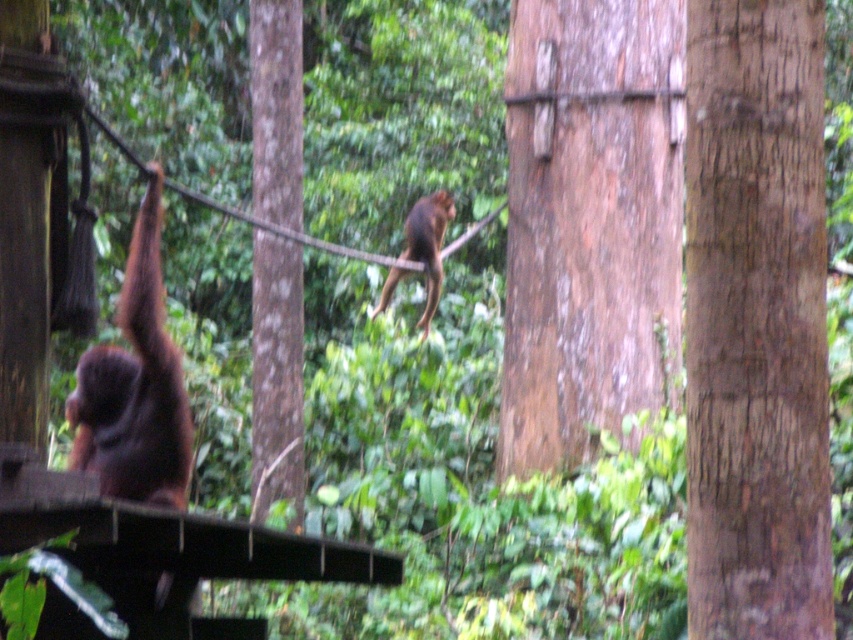
You are an orangutan swinging through the forest and need to grab onto either the brown rough bark at center or the smooth brown tree trunk at center. Which one is closer to your left side?

The brown rough bark at center is positioned on the left side of smooth brown tree trunk at center, so the brown rough bark at center is closer to your left side.